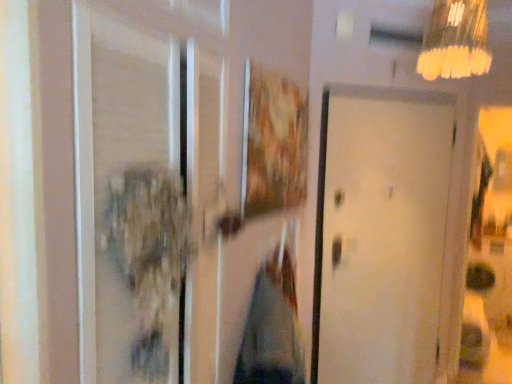
You are a GUI agent. You are given a task and a screenshot of the screen. Output one action in this format:
    pyautogui.click(x=<x>, y=<y>)
    Task: Click on the yellow frosted glass lampshade at upper right
    The width and height of the screenshot is (512, 384).
    Given the screenshot: What is the action you would take?
    pyautogui.click(x=455, y=41)

I want to click on wooden textured picture frame at center, so click(x=273, y=142).

Which of these two, white matte door at center or yellow frosted glass lampshade at upper right, is wider?

Wider between the two is yellow frosted glass lampshade at upper right.

Is white matte door at center next to yellow frosted glass lampshade at upper right and touching it?

There is a gap between white matte door at center and yellow frosted glass lampshade at upper right.

Which is in front, white matte door at center or yellow frosted glass lampshade at upper right?

yellow frosted glass lampshade at upper right is closer to the camera.

Can you confirm if white matte door at center is shorter than yellow frosted glass lampshade at upper right?

Incorrect, the height of white matte door at center does not fall short of that of yellow frosted glass lampshade at upper right.

Does yellow frosted glass lampshade at upper right lie behind transparent glass screen door at left?

Yes.

From the image's perspective, is yellow frosted glass lampshade at upper right positioned above or below transparent glass screen door at left?

Clearly, from the image's perspective, yellow frosted glass lampshade at upper right is above transparent glass screen door at left.

Would you say yellow frosted glass lampshade at upper right is to the left or to the right of transparent glass screen door at left in the picture?

From the image, it's evident that yellow frosted glass lampshade at upper right is to the right of transparent glass screen door at left.

Does point (488, 69) come closer to viewer compared to point (91, 311)?

That is False.

Considering the points (93, 165) and (468, 19), which point is behind, point (93, 165) or point (468, 19)?

The point (468, 19) is behind.

Could you measure the distance between transparent glass screen door at left and yellow frosted glass lampshade at upper right?

They are 4.76 feet apart.

The image size is (512, 384). In order to click on lamp located behind the transparent glass screen door at left in this screenshot , I will do pos(455,41).

In the scene shown: Are transparent glass screen door at left and yellow frosted glass lampshade at upper right located far from each other?

Yes, transparent glass screen door at left is far from yellow frosted glass lampshade at upper right.

How many degrees apart are the facing directions of transparent glass screen door at left and wooden textured picture frame at center?

The angular difference between transparent glass screen door at left and wooden textured picture frame at center is 1.1 degrees.

I want to click on screen door below the wooden textured picture frame at center (from the image's perspective), so click(149, 187).

From the image's perspective, is transparent glass screen door at left above wooden textured picture frame at center?

Actually, transparent glass screen door at left appears below wooden textured picture frame at center in the image.

Considering the sizes of objects white matte door at center and transparent glass screen door at left in the image provided, who is bigger, white matte door at center or transparent glass screen door at left?

Bigger between the two is white matte door at center.

Where is `screen door to the left of white matte door at center`? Image resolution: width=512 pixels, height=384 pixels. screen door to the left of white matte door at center is located at coordinates (149, 187).

In the scene shown: Does white matte door at center appear on the left side of transparent glass screen door at left?

In fact, white matte door at center is to the right of transparent glass screen door at left.

Is transparent glass screen door at left inside white matte door at center?

Definitely not — transparent glass screen door at left is not inside white matte door at center.

Looking at their sizes, would you say wooden textured picture frame at center is wider or thinner than white matte door at center?

wooden textured picture frame at center is thinner than white matte door at center.

Which object is positioned more to the left, wooden textured picture frame at center or white matte door at center?

wooden textured picture frame at center is more to the left.

Is wooden textured picture frame at center positioned behind white matte door at center?

That is False.

Between wooden textured picture frame at center and white matte door at center, which one has smaller size?

wooden textured picture frame at center.

How much distance is there between yellow frosted glass lampshade at upper right and wooden textured picture frame at center?

yellow frosted glass lampshade at upper right is 33.11 inches from wooden textured picture frame at center.

Locate an element on the screen. The height and width of the screenshot is (384, 512). picture frame lying on the left of yellow frosted glass lampshade at upper right is located at coordinates (273, 142).

From a real-world perspective, is yellow frosted glass lampshade at upper right below wooden textured picture frame at center?

No, from a real-world perspective, yellow frosted glass lampshade at upper right is not below wooden textured picture frame at center.

From the image's perspective, who appears lower, yellow frosted glass lampshade at upper right or wooden textured picture frame at center?

wooden textured picture frame at center, from the image's perspective.

In the image, there is a yellow frosted glass lampshade at upper right. At what (x,y) coordinates should I click in order to perform the action: click on door below it (from a real-world perspective). Please return your answer as a coordinate pair (x, y). The image size is (512, 384). Looking at the image, I should click on (380, 234).

Where is `screen door on the left of yellow frosted glass lampshade at upper right`? This screenshot has width=512, height=384. screen door on the left of yellow frosted glass lampshade at upper right is located at coordinates (149, 187).

Considering their positions, is transparent glass screen door at left positioned closer to yellow frosted glass lampshade at upper right than white matte door at center?

white matte door at center lies closer to yellow frosted glass lampshade at upper right than the other object.

From the image, which object appears to be nearer to wooden textured picture frame at center, transparent glass screen door at left or white matte door at center?

Among the two, transparent glass screen door at left is located nearer to wooden textured picture frame at center.

When comparing their distances from white matte door at center, does transparent glass screen door at left or yellow frosted glass lampshade at upper right seem further?

The object further to white matte door at center is transparent glass screen door at left.

Estimate the real-world distances between objects in this image. Which object is further from transparent glass screen door at left, white matte door at center or wooden textured picture frame at center?

Among the two, white matte door at center is located further to transparent glass screen door at left.

From the image, which object appears to be nearer to wooden textured picture frame at center, yellow frosted glass lampshade at upper right or transparent glass screen door at left?

transparent glass screen door at left is positioned closer to the anchor wooden textured picture frame at center.

Considering their positions, is transparent glass screen door at left positioned closer to yellow frosted glass lampshade at upper right than wooden textured picture frame at center?

Based on the image, wooden textured picture frame at center appears to be nearer to yellow frosted glass lampshade at upper right.

Based on the photo, which object lies further to the anchor point yellow frosted glass lampshade at upper right, wooden textured picture frame at center or transparent glass screen door at left?

transparent glass screen door at left is positioned further to the anchor yellow frosted glass lampshade at upper right.

From the image, which object appears to be nearer to white matte door at center, wooden textured picture frame at center or yellow frosted glass lampshade at upper right?

Based on the image, wooden textured picture frame at center appears to be nearer to white matte door at center.

Locate an element on the screen. lamp located between transparent glass screen door at left and white matte door at center in the depth direction is located at coordinates (455, 41).

This screenshot has height=384, width=512. Find the location of `picture frame between transparent glass screen door at left and white matte door at center along the z-axis`. picture frame between transparent glass screen door at left and white matte door at center along the z-axis is located at coordinates (273, 142).

You are a GUI agent. You are given a task and a screenshot of the screen. Output one action in this format:
    pyautogui.click(x=<x>, y=<y>)
    Task: Click on the picture frame between yellow frosted glass lampshade at upper right and white matte door at center in the vertical direction
    Image resolution: width=512 pixels, height=384 pixels.
    Given the screenshot: What is the action you would take?
    pyautogui.click(x=273, y=142)

In order to click on picture frame situated between transparent glass screen door at left and yellow frosted glass lampshade at upper right from left to right in this screenshot , I will do `click(273, 142)`.